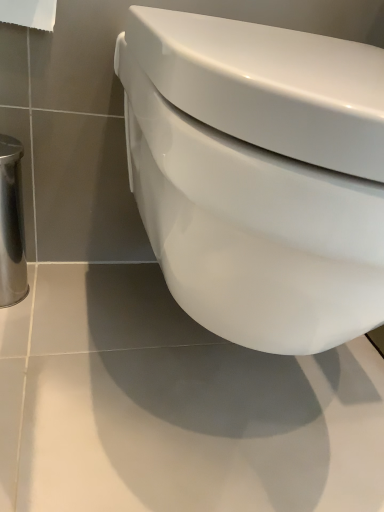
Question: Should I look upward or downward to see white paper at upper left?

Choices:
 (A) up
 (B) down

Answer: (A)

Question: Is white glossy toilet at center taller than white paper at upper left?

Choices:
 (A) no
 (B) yes

Answer: (B)

Question: Can you confirm if white glossy toilet at center is shorter than white paper at upper left?

Choices:
 (A) no
 (B) yes

Answer: (A)

Question: Is white glossy toilet at center far from white paper at upper left?

Choices:
 (A) yes
 (B) no

Answer: (B)

Question: Is white glossy toilet at center smaller than white paper at upper left?

Choices:
 (A) no
 (B) yes

Answer: (A)

Question: Is white glossy toilet at center thinner than white paper at upper left?

Choices:
 (A) yes
 (B) no

Answer: (B)

Question: From a real-world perspective, is white glossy toilet at center under white paper at upper left?

Choices:
 (A) no
 (B) yes

Answer: (B)

Question: Can you confirm if white paper at upper left is bigger than white glossy toilet at center?

Choices:
 (A) no
 (B) yes

Answer: (A)

Question: Is white paper at upper left oriented away from white glossy toilet at center?

Choices:
 (A) no
 (B) yes

Answer: (A)

Question: Can you confirm if white paper at upper left is wider than white glossy toilet at center?

Choices:
 (A) yes
 (B) no

Answer: (B)

Question: Is white glossy toilet at center completely or partially inside white paper at upper left?

Choices:
 (A) no
 (B) yes

Answer: (A)

Question: Does white paper at upper left touch white glossy toilet at center?

Choices:
 (A) yes
 (B) no

Answer: (B)

Question: From a real-world perspective, is white paper at upper left on white glossy toilet at center?

Choices:
 (A) no
 (B) yes

Answer: (B)

Question: Considering the relative positions of white glossy toilet at center and white paper at upper left in the image provided, is white glossy toilet at center to the left or to the right of white paper at upper left?

Choices:
 (A) left
 (B) right

Answer: (B)